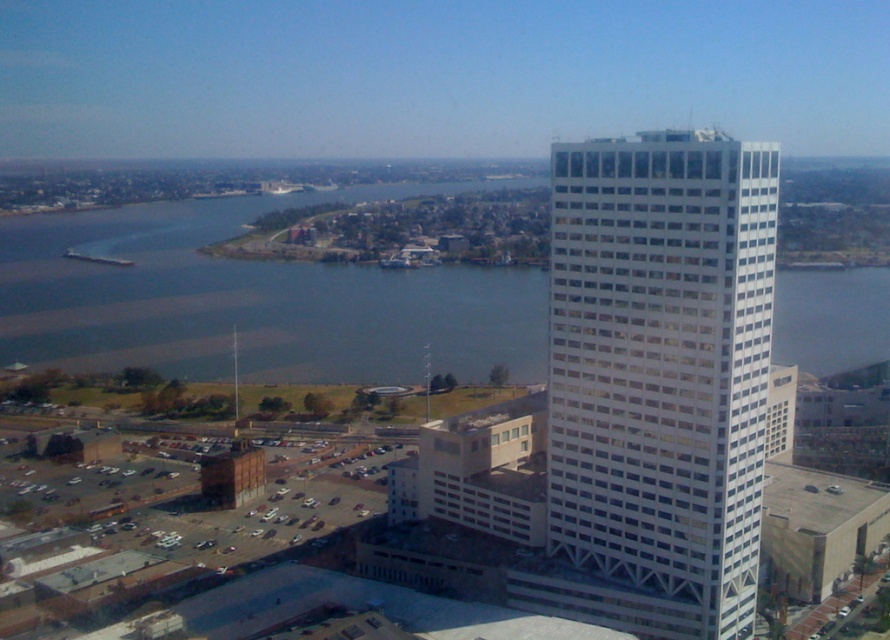
Question: Can you confirm if white glass building at upper right is positioned below blue water at center?

Choices:
 (A) no
 (B) yes

Answer: (B)

Question: Does white glass building at upper right appear under blue water at center?

Choices:
 (A) no
 (B) yes

Answer: (B)

Question: In this image, where is white glass building at upper right located relative to blue water at center?

Choices:
 (A) below
 (B) above

Answer: (A)

Question: Which object is closer to the camera taking this photo?

Choices:
 (A) blue water at center
 (B) white glass building at upper right

Answer: (B)